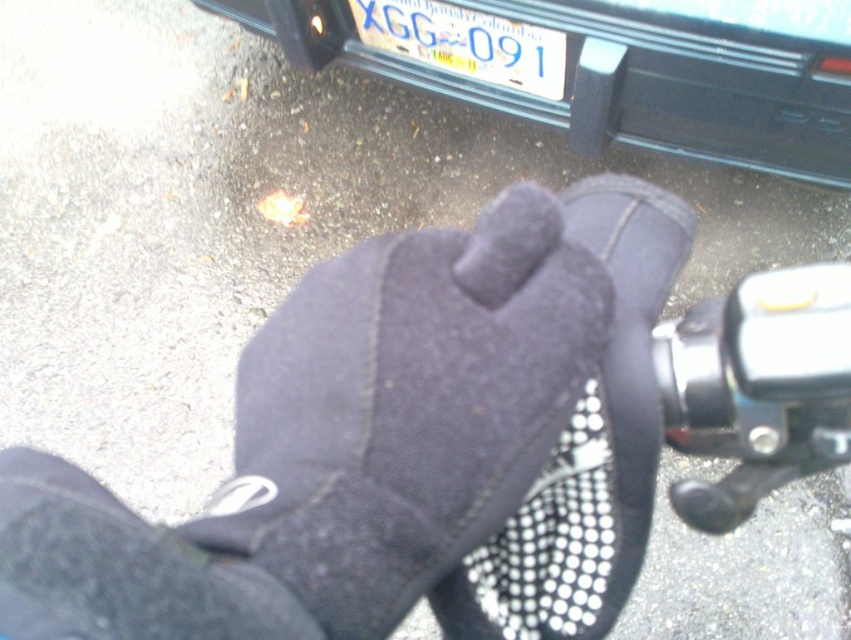
You are a photographer trying to capture the gloved hand on the bicycle handlebar. You notice two points marked in the image. Which point, point [635,81] or point [510,60], is closer to your camera lens?

Point [635,81] is closer to the camera lens than point [510,60].

You are standing in front of the bicycle handlebar and want to determine which of the two points, point [608,241] or point [480,80], is nearer to you. Based on the image, which point is closer?

Point [608,241] is closer to the viewer than point [480,80].

You are a delivery person checking your bike and vehicle before starting your route. You notice the black suede glove at center and the white plastic license plate at center. Which object is closer to the ground?

The black suede glove at center is positioned under the white plastic license plate at center, so it is closer to the ground.